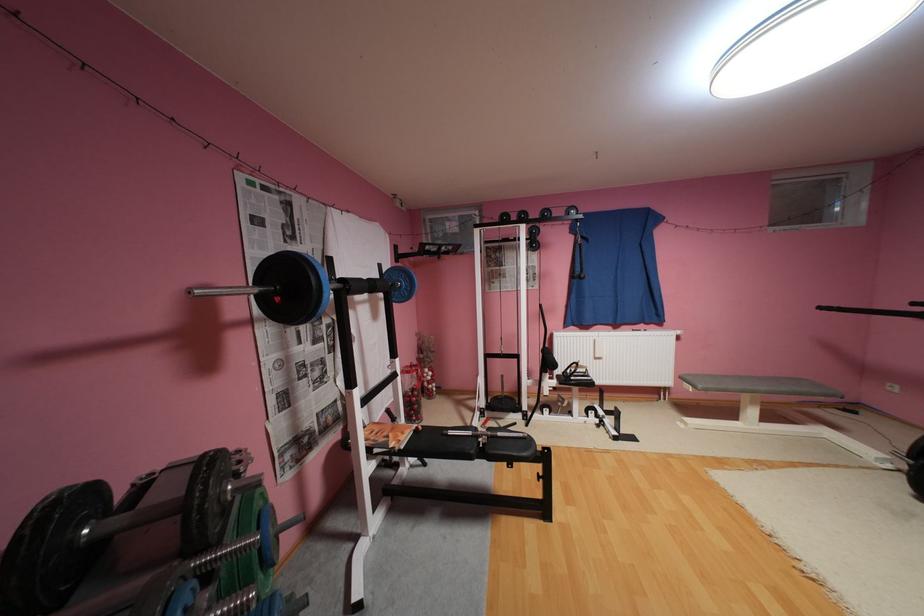
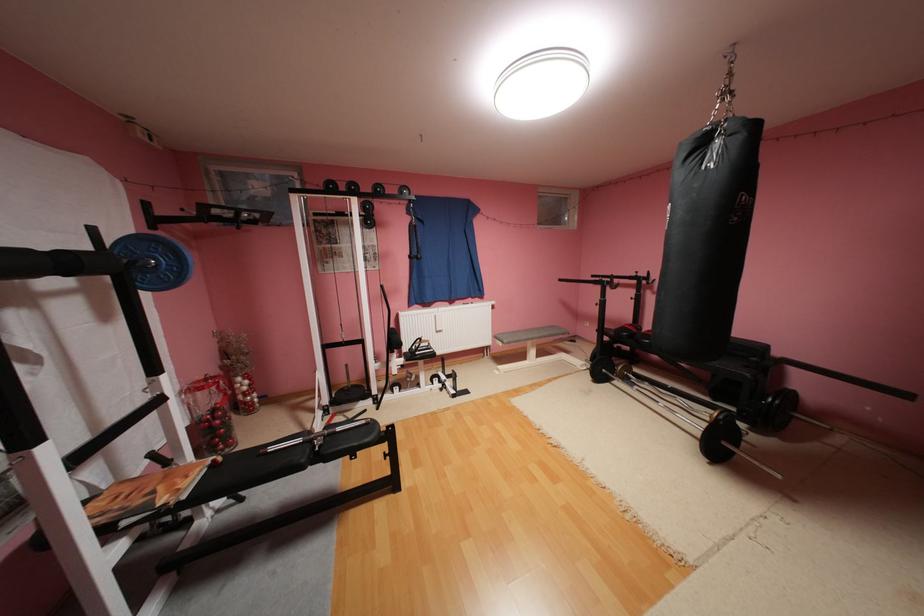
Question: The camera is either moving clockwise (left) or counter-clockwise (right) around the object. The first image is from the beginning of the video and the second image is from the end. Is the camera moving left or right when shooting the video?

Choices:
 (A) Left
 (B) Right

Answer: (A)